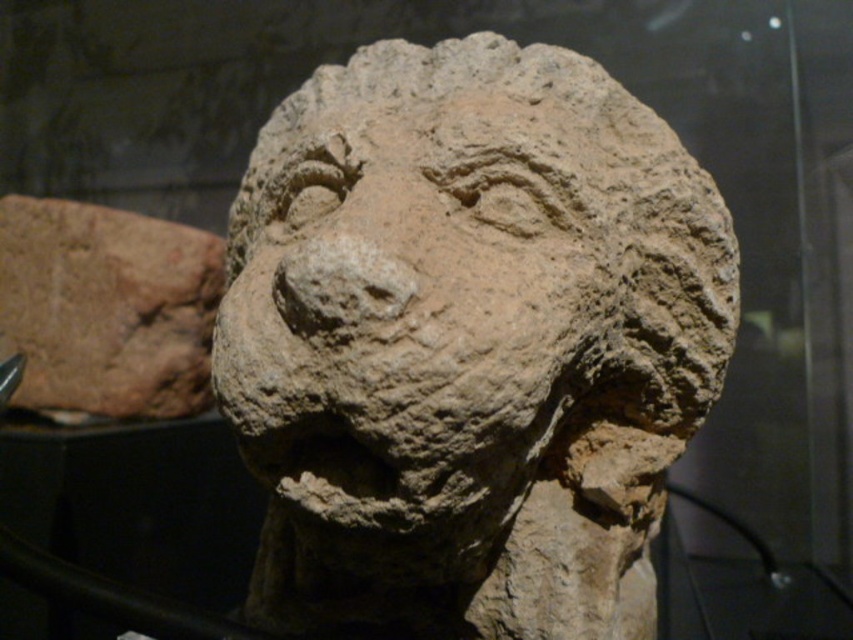
Question: Can you confirm if earthen stone lion at center is thinner than brown clay head at left?

Choices:
 (A) no
 (B) yes

Answer: (A)

Question: Is earthen stone lion at center positioned before brown clay head at left?

Choices:
 (A) yes
 (B) no

Answer: (A)

Question: Which of the following is the closest to the observer?

Choices:
 (A) (109, 406)
 (B) (544, 401)

Answer: (B)

Question: Considering the relative positions of earthen stone lion at center and brown clay head at left in the image provided, where is earthen stone lion at center located with respect to brown clay head at left?

Choices:
 (A) below
 (B) above

Answer: (A)

Question: Which of the following is the farthest from the observer?

Choices:
 (A) earthen stone lion at center
 (B) brown clay head at left

Answer: (B)